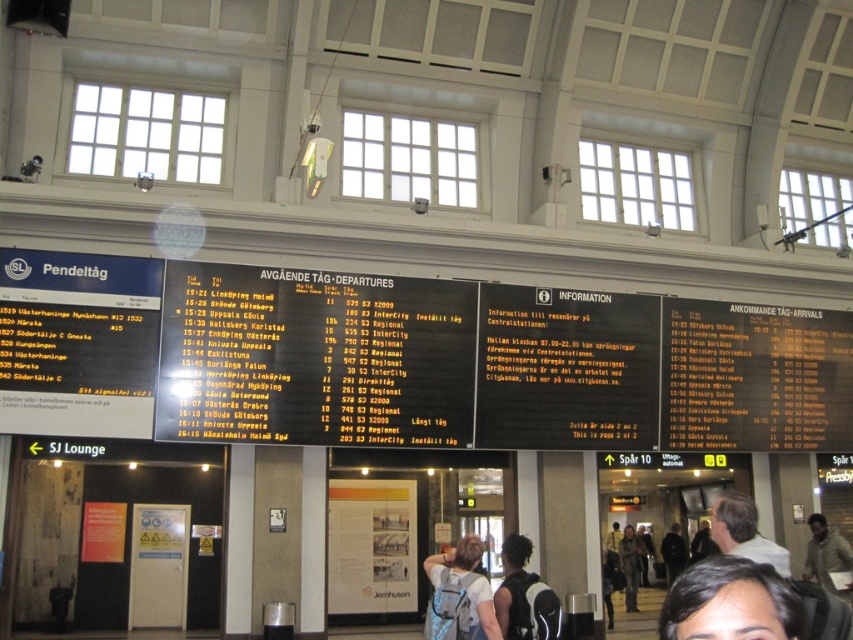
Question: Where is dark brown backpack at center located in relation to light brown hair at center in the image?

Choices:
 (A) below
 (B) above

Answer: (B)

Question: Which point is closer to the camera?

Choices:
 (A) click(515, 620)
 (B) click(746, 518)
 (C) click(714, 422)
 (D) click(467, 548)

Answer: (B)

Question: Does black matte departure board at center have a smaller size compared to light blue backpack at center?

Choices:
 (A) yes
 (B) no

Answer: (B)

Question: Among these objects, which one is nearest to the camera?

Choices:
 (A) dark brown backpack at center
 (B) light brown hair at center

Answer: (B)

Question: Is light blue backpack at center above light brown hair at center?

Choices:
 (A) yes
 (B) no

Answer: (B)

Question: Which of the following is the farthest from the observer?

Choices:
 (A) (695, 636)
 (B) (683, 392)

Answer: (B)